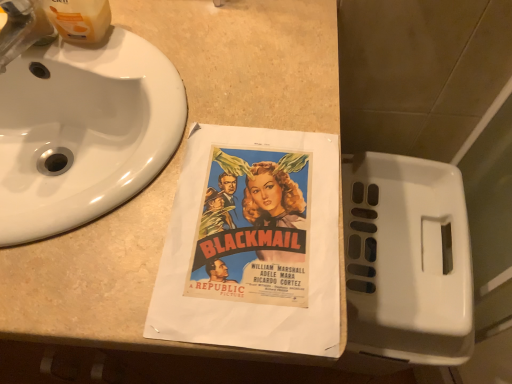
Question: Considering the relative sizes of beige laminate counter at center and brushed metal faucet at upper left in the image provided, is beige laminate counter at center bigger than brushed metal faucet at upper left?

Choices:
 (A) yes
 (B) no

Answer: (A)

Question: Could you tell me if beige laminate counter at center is facing brushed metal faucet at upper left?

Choices:
 (A) no
 (B) yes

Answer: (A)

Question: From a real-world perspective, is beige laminate counter at center on brushed metal faucet at upper left?

Choices:
 (A) no
 (B) yes

Answer: (A)

Question: From the image's perspective, is beige laminate counter at center on brushed metal faucet at upper left?

Choices:
 (A) yes
 (B) no

Answer: (B)

Question: Is beige laminate counter at center taller than brushed metal faucet at upper left?

Choices:
 (A) yes
 (B) no

Answer: (A)

Question: Is beige laminate counter at center at the left side of brushed metal faucet at upper left?

Choices:
 (A) no
 (B) yes

Answer: (B)

Question: Is the surface of brushed metal faucet at upper left in direct contact with beige laminate counter at center?

Choices:
 (A) yes
 (B) no

Answer: (B)

Question: Does brushed metal faucet at upper left appear on the left side of beige laminate counter at center?

Choices:
 (A) yes
 (B) no

Answer: (B)

Question: Is beige laminate counter at center a part of brushed metal faucet at upper left?

Choices:
 (A) no
 (B) yes

Answer: (A)

Question: From a real-world perspective, is brushed metal faucet at upper left located beneath beige laminate counter at center?

Choices:
 (A) yes
 (B) no

Answer: (B)

Question: Is the position of brushed metal faucet at upper left more distant than that of beige laminate counter at center?

Choices:
 (A) no
 (B) yes

Answer: (B)

Question: Is brushed metal faucet at upper left in front of beige laminate counter at center?

Choices:
 (A) no
 (B) yes

Answer: (A)

Question: Is white glossy sink at upper left positioned behind brushed metal faucet at upper left?

Choices:
 (A) no
 (B) yes

Answer: (A)